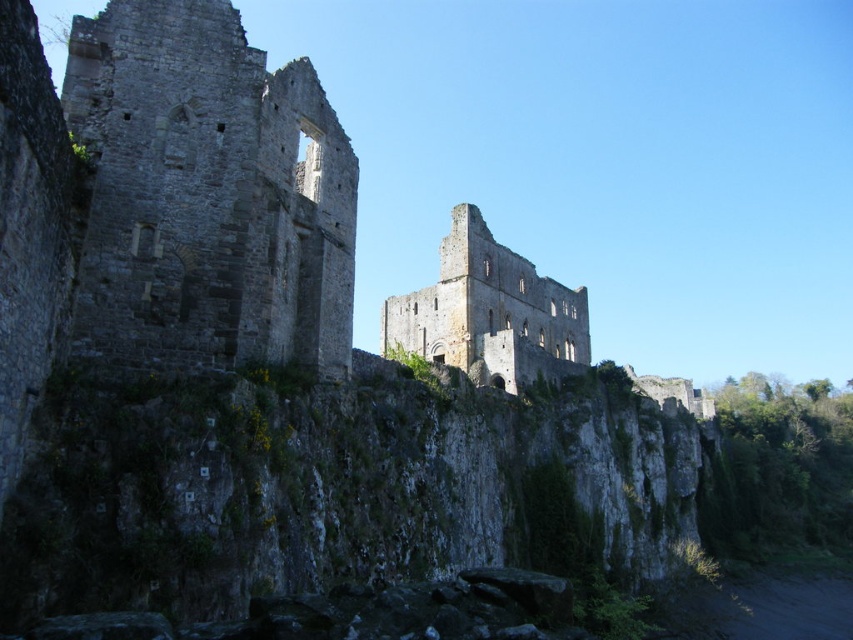
Does gray stone ruins at center have a smaller size compared to rustic stone ruins at center?

Yes, gray stone ruins at center is smaller than rustic stone ruins at center.

Can you confirm if gray stone ruins at center is bigger than rustic stone ruins at center?

Actually, gray stone ruins at center might be smaller than rustic stone ruins at center.

This screenshot has height=640, width=853. What do you see at coordinates (207, 193) in the screenshot? I see `gray stone ruins at center` at bounding box center [207, 193].

Locate an element on the screen. The width and height of the screenshot is (853, 640). gray stone ruins at center is located at coordinates (207, 193).